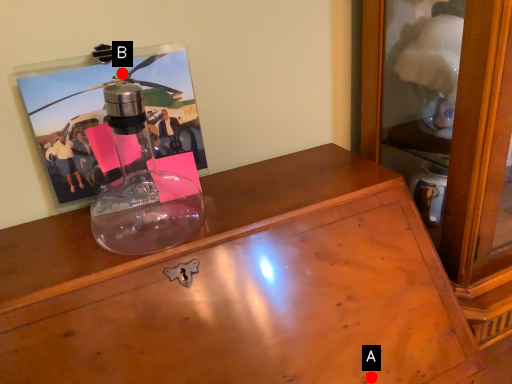
Question: Two points are circled on the image, labeled by A and B beside each circle. Which point is closer to the camera?

Choices:
 (A) A is closer
 (B) B is closer

Answer: (A)